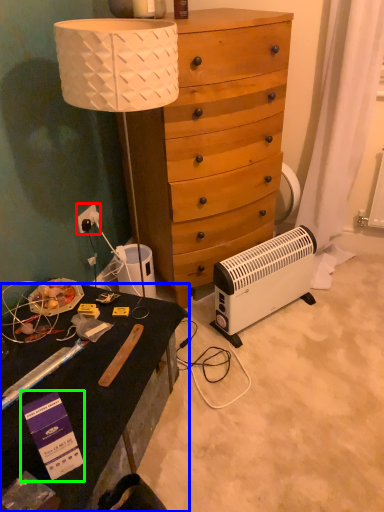
Question: Considering the real-world distances, which object is closest to power outlet (highlighted by a red box)? desk (highlighted by a blue box) or box (highlighted by a green box).

Choices:
 (A) desk
 (B) box

Answer: (A)